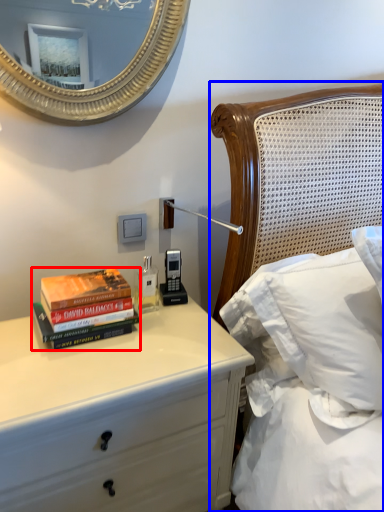
Question: Which object is further to the camera taking this photo, book (highlighted by a red box) or bed (highlighted by a blue box)?

Choices:
 (A) book
 (B) bed

Answer: (A)